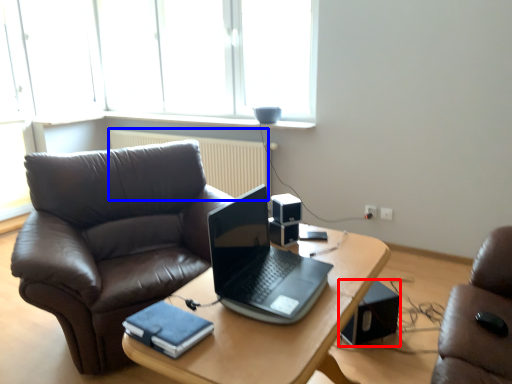
Question: Which of the following is the closest to the observer, loudspeaker (highlighted by a red box) or radiator (highlighted by a blue box)?

Choices:
 (A) loudspeaker
 (B) radiator

Answer: (A)